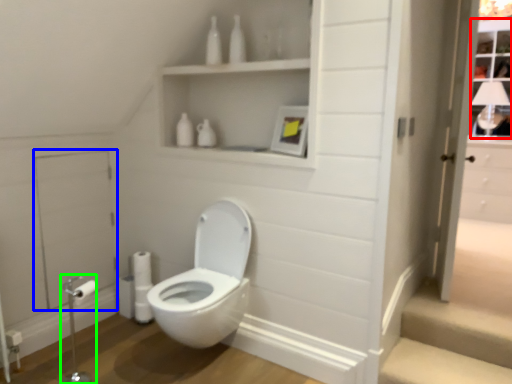
Question: Which object is positioned closest to window (highlighted by a red box)? Select from screen door (highlighted by a blue box) and towel bar (highlighted by a green box).

Choices:
 (A) screen door
 (B) towel bar

Answer: (A)